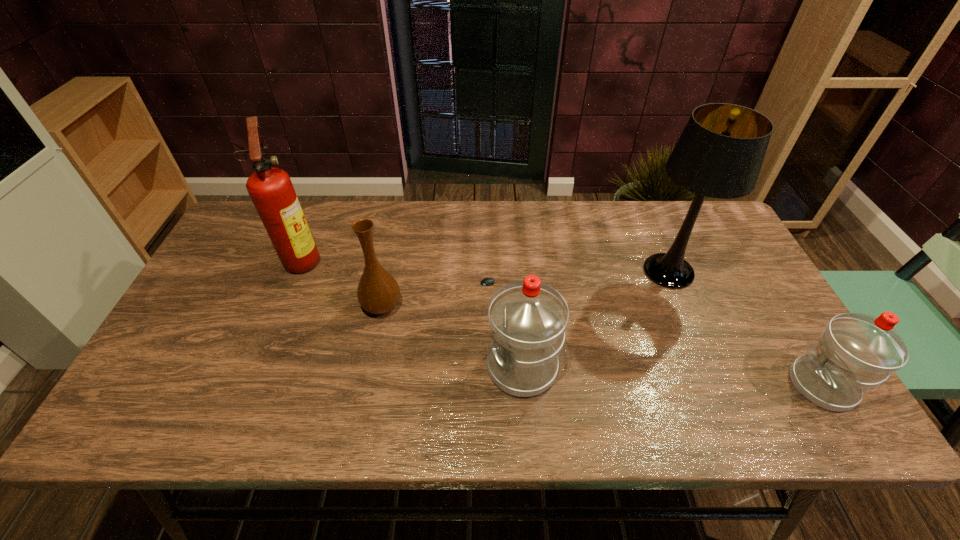
The image size is (960, 540). I want to click on vacant space situated on the handle side of the shorter water bottle, so click(x=752, y=385).

Where is `vacant region located 0.050m on the handle side of the shorter water bottle`? Image resolution: width=960 pixels, height=540 pixels. vacant region located 0.050m on the handle side of the shorter water bottle is located at coordinates (769, 385).

You are a GUI agent. You are given a task and a screenshot of the screen. Output one action in this format:
    pyautogui.click(x=<x>, y=<y>)
    Task: Click on the vacant space situated 0.220m on the handle side of the shorter water bottle
    The width and height of the screenshot is (960, 540).
    Given the screenshot: What is the action you would take?
    pyautogui.click(x=696, y=385)

Identify the location of vacant region located 0.240m on the right of the vase. The width and height of the screenshot is (960, 540). (492, 306).

Identify the location of vacant space situated 0.240m on the back of the fifth object from left to right. The image size is (960, 540). (639, 200).

Locate an element on the screen. free region located on the front of the mouse is located at coordinates (500, 369).

The height and width of the screenshot is (540, 960). Find the location of `free space located 0.390m on the front-facing side of the fire extinguisher`. free space located 0.390m on the front-facing side of the fire extinguisher is located at coordinates (453, 259).

Locate an element on the screen. The height and width of the screenshot is (540, 960). table lamp that is at the far edge is located at coordinates (720, 152).

Identify the location of fire extinguisher that is positioned at the far edge. The height and width of the screenshot is (540, 960). (270, 189).

Where is `water bottle at the right edge`? This screenshot has height=540, width=960. water bottle at the right edge is located at coordinates (856, 352).